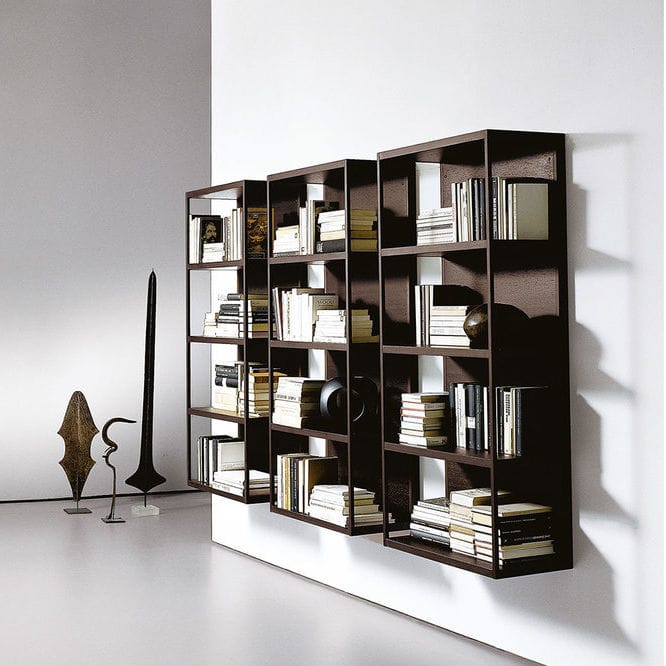
Locate an element on the screen. The width and height of the screenshot is (666, 666). tops of bookshelves empty is located at coordinates (464, 134), (439, 151), (423, 141), (316, 162), (274, 170), (182, 186), (220, 176), (232, 170).